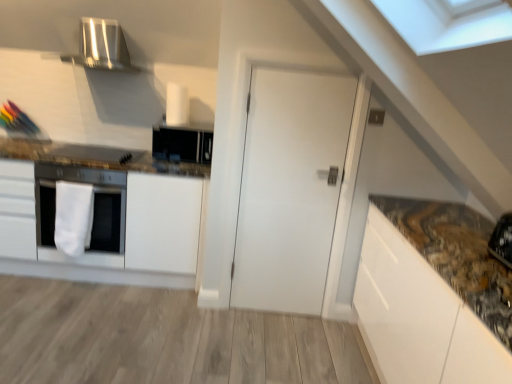
The height and width of the screenshot is (384, 512). In order to click on vacant area that is situated to the right of white matte door at center in this screenshot , I will do `click(319, 327)`.